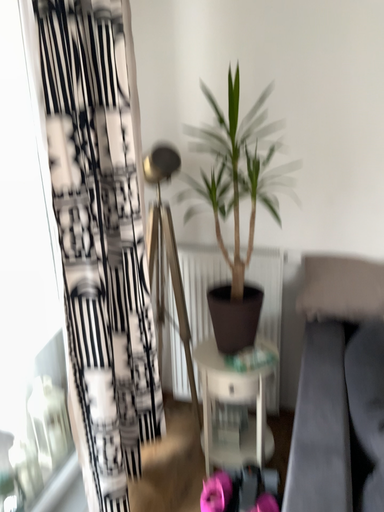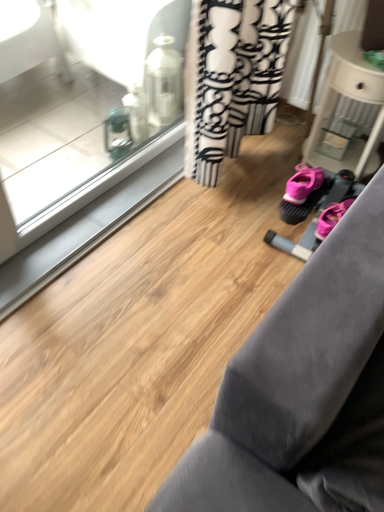
Question: How did the camera likely rotate when shooting the video?

Choices:
 (A) rotated downward
 (B) rotated upward

Answer: (A)